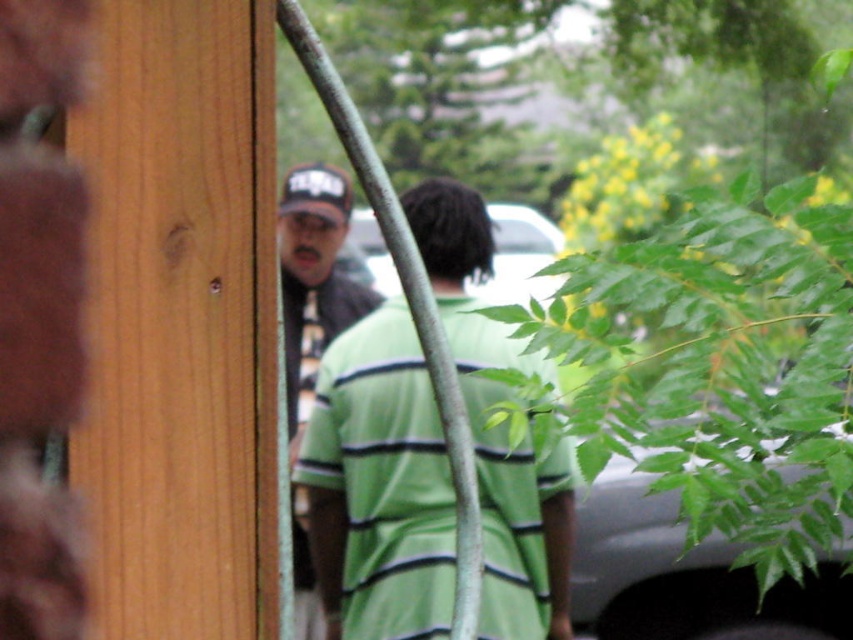
Is point (473, 317) closer to camera compared to point (291, 500)?

No, it is behind (291, 500).

How much distance is there between green striped shirt at center and matte black cap at upper left?

green striped shirt at center is 6.94 inches away from matte black cap at upper left.

Between point (323, 608) and point (285, 257), which one is positioned behind?

The point (285, 257) is more distant.

In order to click on green striped shirt at center in this screenshot , I will do `click(379, 484)`.

From the picture: Does wooden door at left have a greater width compared to matte black cap at upper left?

No.

Which is in front, point (177, 579) or point (312, 346)?

Positioned in front is point (177, 579).

The image size is (853, 640). I want to click on wooden door at left, so click(181, 321).

Who is more forward, [207,600] or [422,371]?

Point [207,600] is in front.

Who is more distant from viewer, (x=138, y=570) or (x=519, y=493)?

The point (x=519, y=493) is behind.

Does point (259, 1) come behind point (416, 433)?

No, it is not.

Identify the location of wooden door at left. (181, 321).